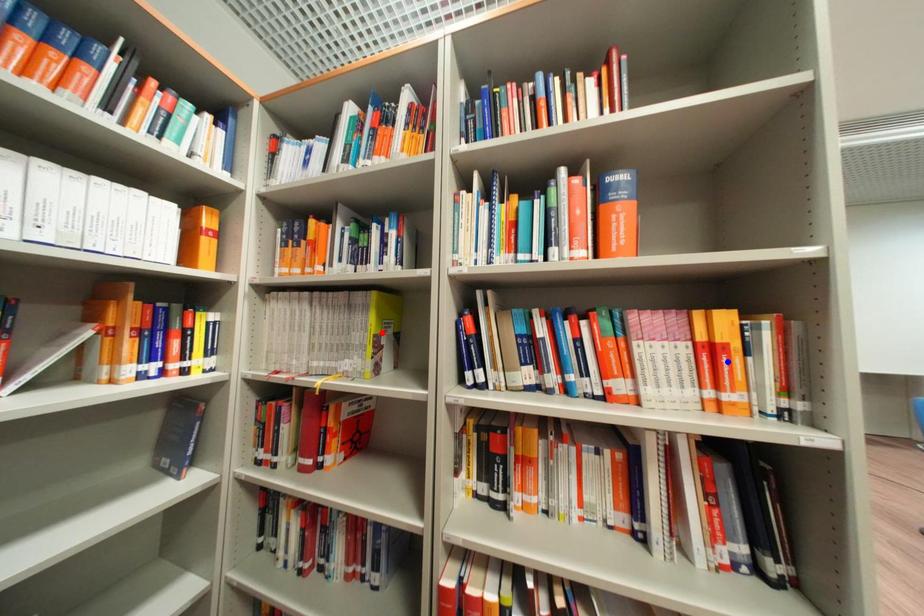
Question: In the image, two points are highlighted. Which point is nearer to the camera? Reply with the corresponding letter.

Choices:
 (A) blue point
 (B) red point

Answer: (A)